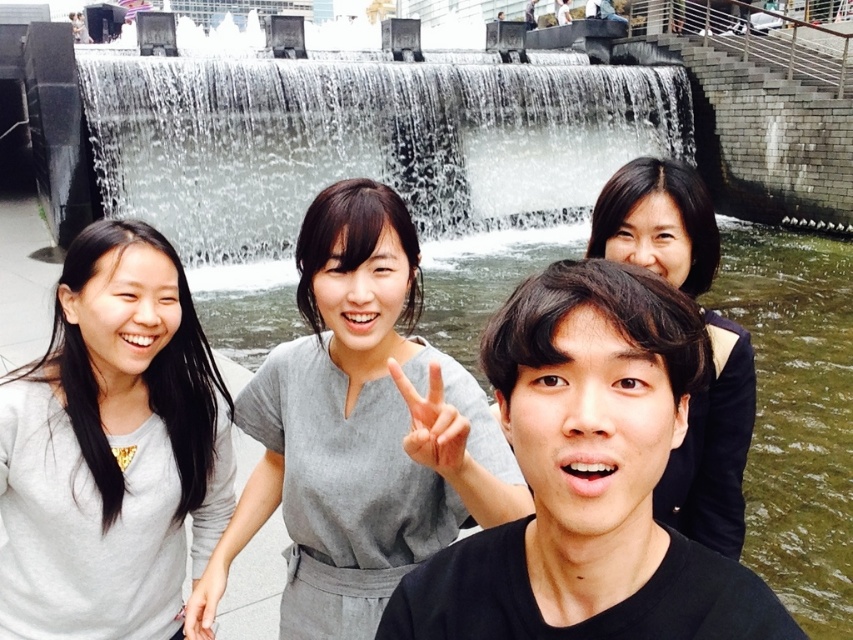
Is gray matte dress at center closer to camera compared to dark brown hair at upper right?

No, it is not.

What do you see at coordinates (352, 428) in the screenshot? I see `gray matte dress at center` at bounding box center [352, 428].

What do you see at coordinates (352, 428) in the screenshot?
I see `gray matte dress at center` at bounding box center [352, 428].

I want to click on gray matte dress at center, so click(352, 428).

Is point (679, 420) farther from viewer compared to point (138, 266)?

No.

This screenshot has width=853, height=640. In order to click on black matte shirt at center in this screenshot , I will do `click(589, 480)`.

This screenshot has width=853, height=640. In order to click on black matte shirt at center in this screenshot , I will do `click(589, 480)`.

Is clear water at center closer to the viewer compared to black matte shirt at center?

No.

Between clear water at center and black matte shirt at center, which one has more height?

clear water at center

Is point (664, 122) closer to camera compared to point (560, 518)?

No, (664, 122) is behind (560, 518).

This screenshot has height=640, width=853. Find the location of `clear water at center`. clear water at center is located at coordinates (364, 141).